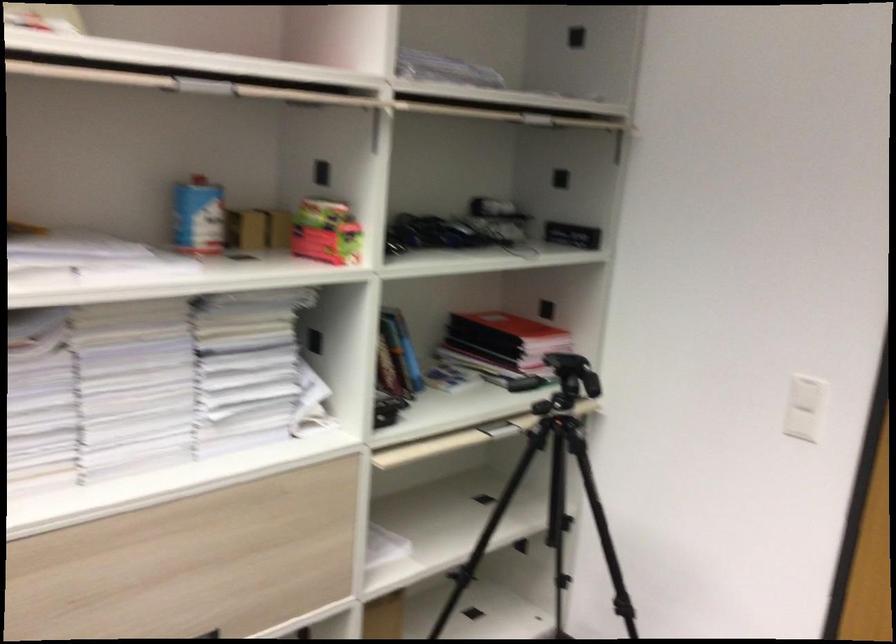
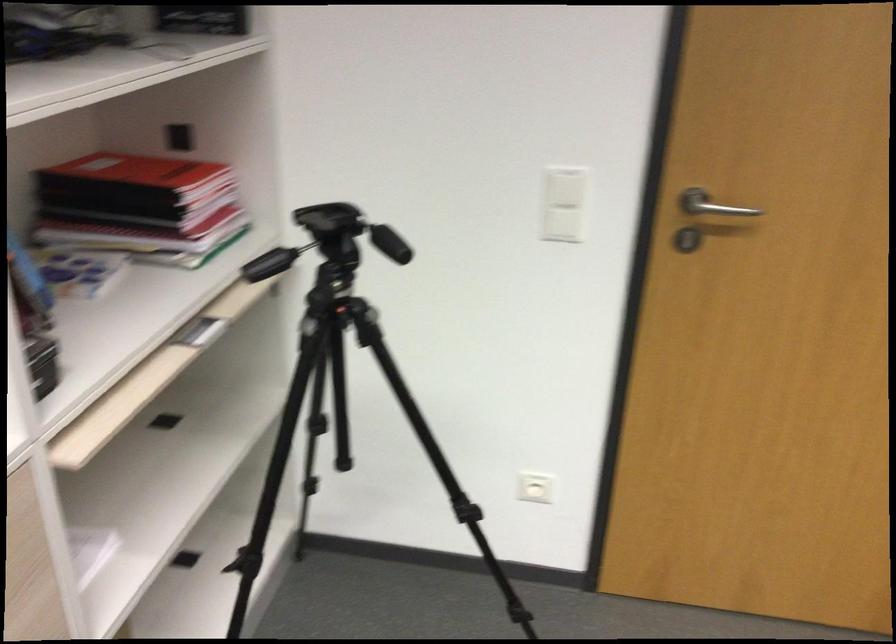
Where in the second image is the point corresponding to pixel 814 393 from the first image?

(565, 187)